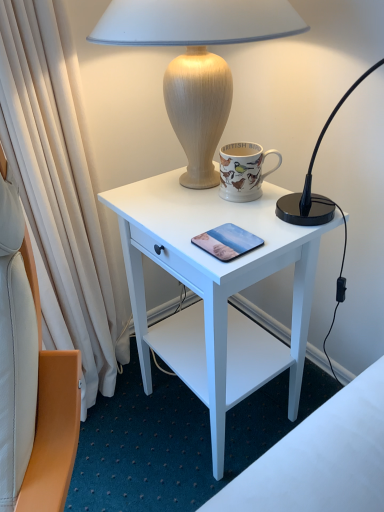
The width and height of the screenshot is (384, 512). Find the location of `vacant space underneath wooden lamp at upper center (from a real-world perspective)`. vacant space underneath wooden lamp at upper center (from a real-world perspective) is located at coordinates (187, 196).